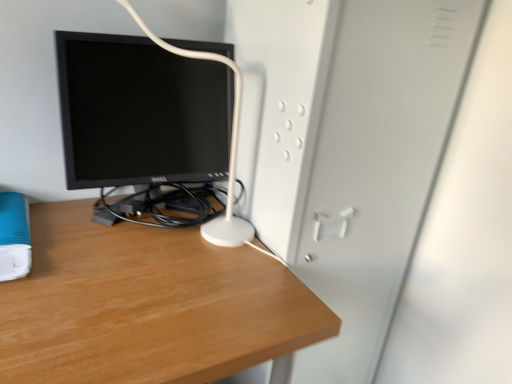
Question: In terms of height, does black glossy monitor at center look taller or shorter compared to blue matte paperback book at lower left?

Choices:
 (A) tall
 (B) short

Answer: (A)

Question: In terms of width, does black glossy monitor at center look wider or thinner when compared to blue matte paperback book at lower left?

Choices:
 (A) thin
 (B) wide

Answer: (A)

Question: Estimate the real-world distances between objects in this image. Which object is farther from the wooden desk at center?

Choices:
 (A) blue matte paperback book at lower left
 (B) black glossy monitor at center
 (C) white matte file cabinet at center

Answer: (C)

Question: Which object is the closest to the black glossy monitor at center?

Choices:
 (A) blue matte paperback book at lower left
 (B) white matte file cabinet at center
 (C) wooden desk at center

Answer: (C)